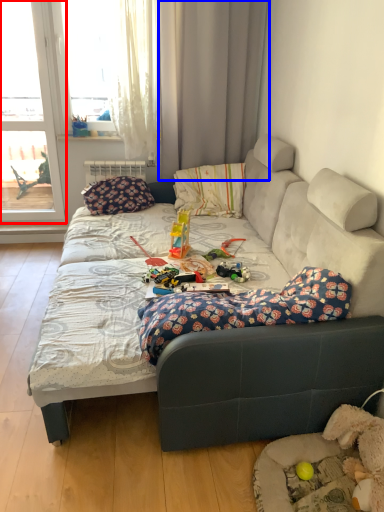
Question: Which object is further to the camera taking this photo, window (highlighted by a red box) or curtain (highlighted by a blue box)?

Choices:
 (A) window
 (B) curtain

Answer: (A)